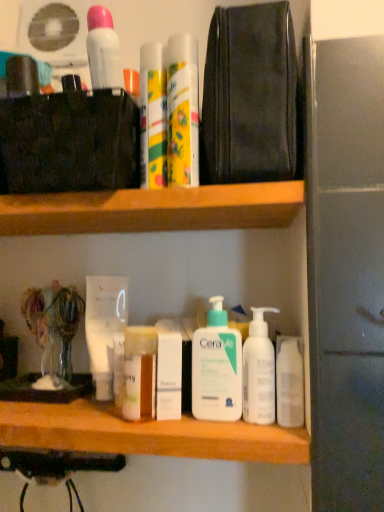
Where is `free point to the right of translucent plastic jar at center, which appears as the second toiletry when viewed from the top`? free point to the right of translucent plastic jar at center, which appears as the second toiletry when viewed from the top is located at coordinates (228, 430).